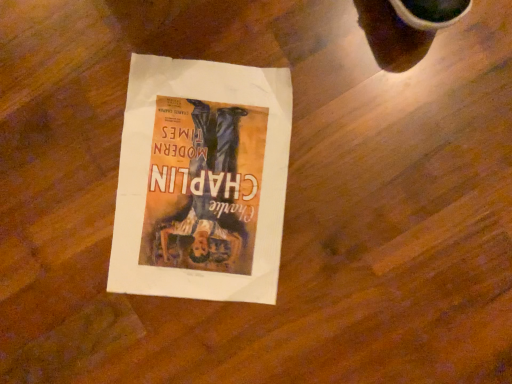
Find the location of a particular element. The image size is (512, 384). blank space situated above matte paper poster at center (from a real-world perspective) is located at coordinates (201, 178).